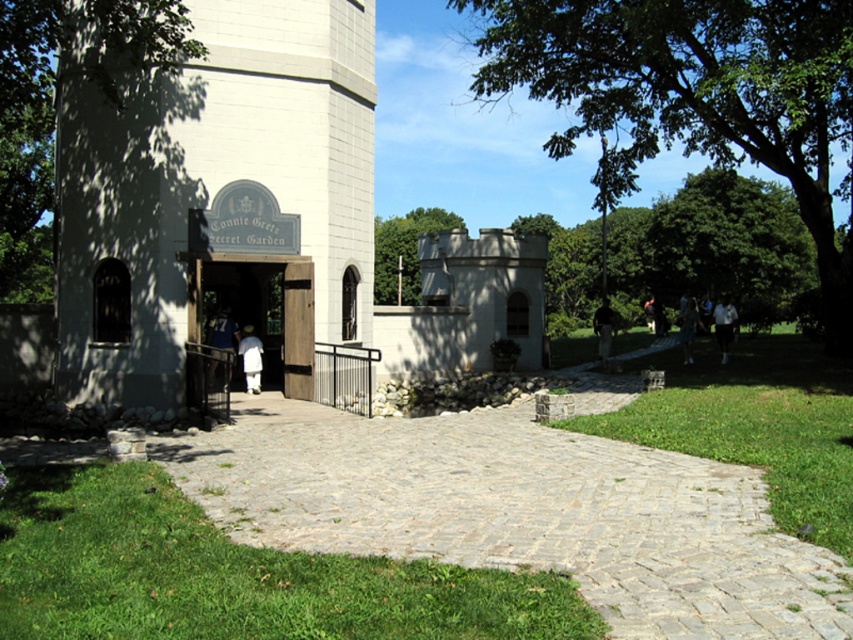
You are standing at the entrance of Connie Gretz Secret Garden and want to walk towards the gray cobblestone path at center. What direction should you face to head directly towards it?

Since the gray cobblestone path at center is located at point (518, 512), you should face towards the center of the image to head directly towards it.